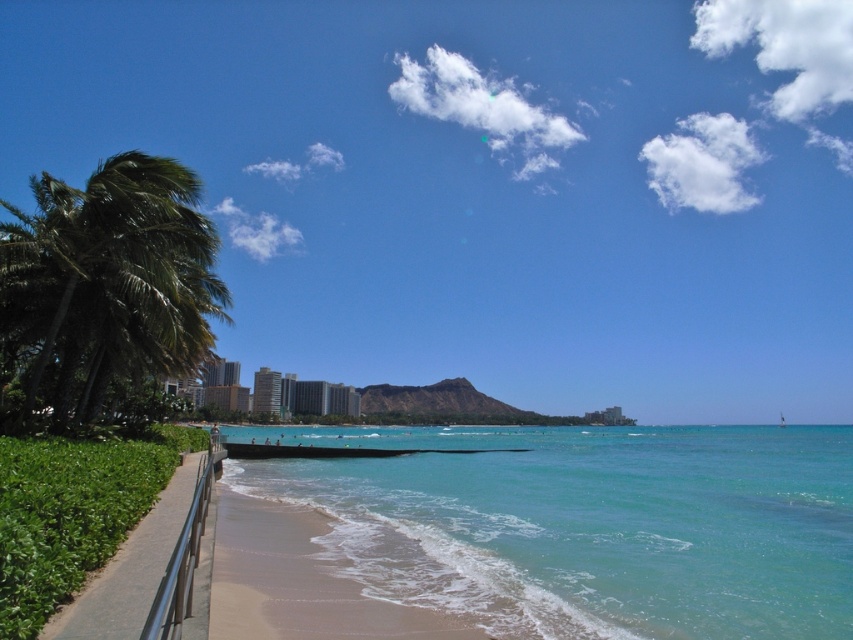
You are standing at the camera position and want to reach the point marked at coordinates point (608, 77). If your walking speed is 3 feet per second, how many seconds will it take you to reach that point?

The distance between point (608, 77) and the camera is 1292.05 feet. At a walking speed of 3 feet per second, it would take approximately 430.68 seconds to reach the point.

You are standing on the beach and looking at the scene. Where exactly is the transparent blue sky at upper center located in terms of coordinates?

The transparent blue sky at upper center is located at coordinates point (488,186).

You are a bird flying over the beach and want to land on the green leafy palm tree at left. Which direction should you fly from the transparent blue sky at upper center to reach it?

The transparent blue sky at upper center is above the green leafy palm tree at left, so you should fly downward from the transparent blue sky at upper center to land on the green leafy palm tree at left.